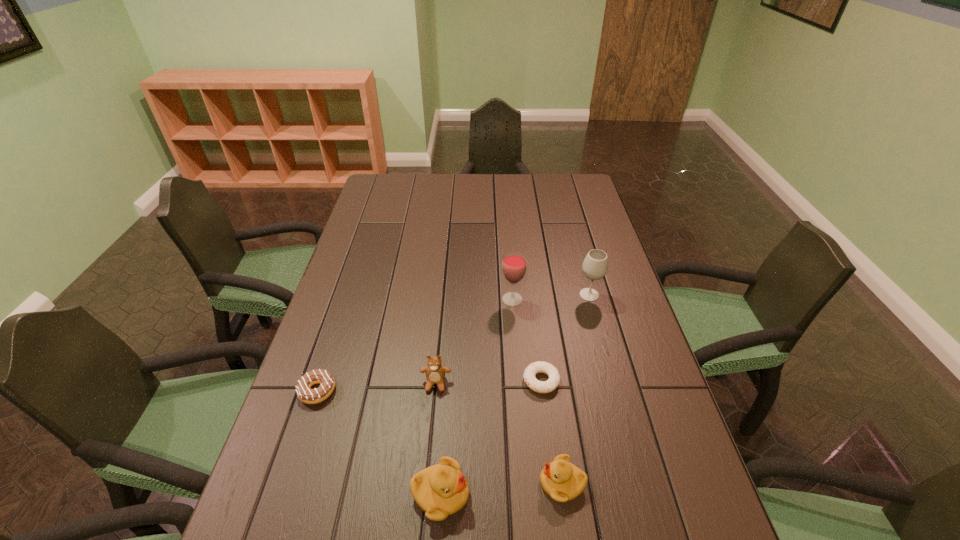
At what (x,y) coordinates should I click in order to perform the action: click on unoccupied position between the taller doughnut and the left duckling. Please return your answer as a coordinate pair (x, y). Looking at the image, I should click on (379, 443).

Identify the location of free point between the shorter doughnut and the teddy bear. (489, 382).

Identify the location of vacant point located between the right doughnut and the taller duckling. This screenshot has height=540, width=960. (491, 438).

Where is `vacant space that is in between the taller doughnut and the teddy bear`? This screenshot has height=540, width=960. vacant space that is in between the taller doughnut and the teddy bear is located at coordinates (376, 387).

This screenshot has height=540, width=960. I want to click on free space between the teddy bear and the left wineglass, so click(x=474, y=341).

Identify which object is located as the third nearest to the leftmost object. Please provide its 2D coordinates. Your answer should be formatted as a tuple, i.e. [(x, y)], where the tuple contains the x and y coordinates of a point satisfying the conditions above.

[(551, 384)]

Identify which object is the third closest to the teddy bear. Please provide its 2D coordinates. Your answer should be formatted as a tuple, i.e. [(x, y)], where the tuple contains the x and y coordinates of a point satisfying the conditions above.

[(323, 377)]